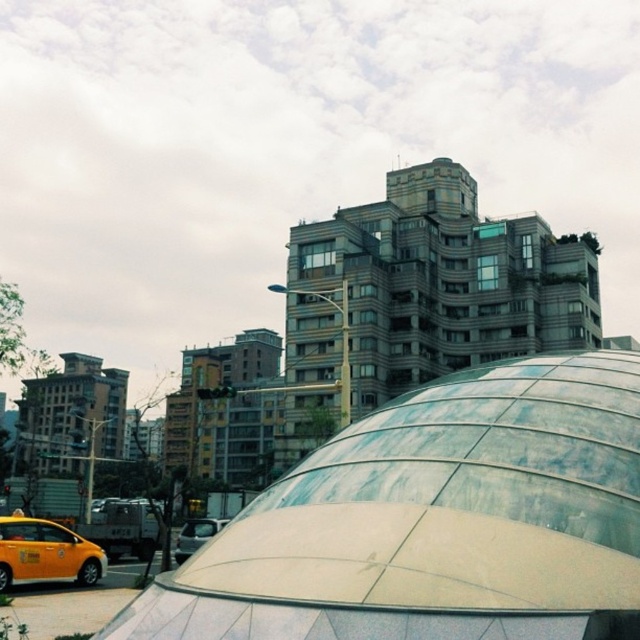
Between transparent glass dome at center and silver metallic van at center, which one appears on the left side from the viewer's perspective?

silver metallic van at center

Describe the element at coordinates (436, 520) in the screenshot. I see `transparent glass dome at center` at that location.

Who is more distant from viewer, [547,515] or [186,552]?

The point [186,552] is behind.

Where is `transparent glass dome at center`? transparent glass dome at center is located at coordinates (436, 520).

Between yellow matte taxi at lower left and silver metallic van at center, which one is positioned lower?

silver metallic van at center is lower down.

Is yellow matte taxi at lower left above silver metallic van at center?

Correct, yellow matte taxi at lower left is located above silver metallic van at center.

Is point (16, 532) positioned behind point (177, 541)?

No, it is in front of (177, 541).

You are a GUI agent. You are given a task and a screenshot of the screen. Output one action in this format:
    pyautogui.click(x=<x>, y=<y>)
    Task: Click on the yellow matte taxi at lower left
    This screenshot has width=640, height=640.
    Given the screenshot: What is the action you would take?
    pyautogui.click(x=45, y=554)

Which of these two, transparent glass dome at center or yellow matte taxi at lower left, stands taller?

With more height is transparent glass dome at center.

This screenshot has width=640, height=640. Find the location of `transparent glass dome at center`. transparent glass dome at center is located at coordinates (436, 520).